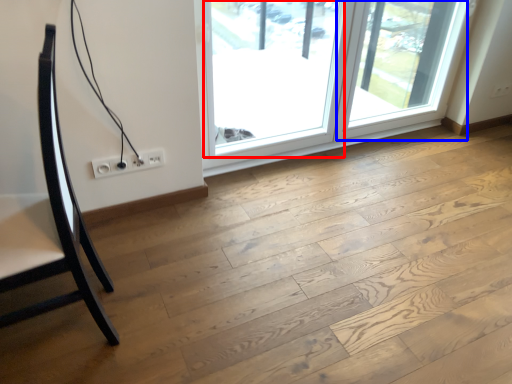
Question: Which point is closer to the camera, window (highlighted by a red box) or screen door (highlighted by a blue box)?

Choices:
 (A) window
 (B) screen door

Answer: (A)